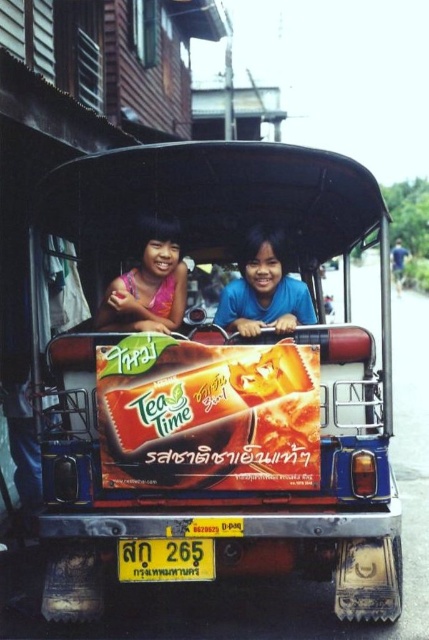
Question: Which of the following is the closest to the observer?

Choices:
 (A) blue fabric coach at right
 (B) matte pink dress at center
 (C) metallic blue tuk-tuk at center

Answer: (C)

Question: Which object appears closest to the camera in this image?

Choices:
 (A) blue fabric coach at right
 (B) blue fabric shirt at center
 (C) matte plastic tea bag at center

Answer: (C)

Question: Is matte plastic tea bag at center further to camera compared to yellow plastic license plate at lower center?

Choices:
 (A) yes
 (B) no

Answer: (B)

Question: Does matte pink dress at center have a lesser width compared to blue fabric coach at right?

Choices:
 (A) no
 (B) yes

Answer: (A)

Question: Does matte plastic tea bag at center appear on the right side of yellow plastic license plate at lower center?

Choices:
 (A) yes
 (B) no

Answer: (A)

Question: Considering the real-world distances, which object is farthest from the blue fabric coach at right?

Choices:
 (A) matte pink dress at center
 (B) blue fabric shirt at center
 (C) matte plastic tea bag at center
 (D) metallic blue tuk-tuk at center

Answer: (C)